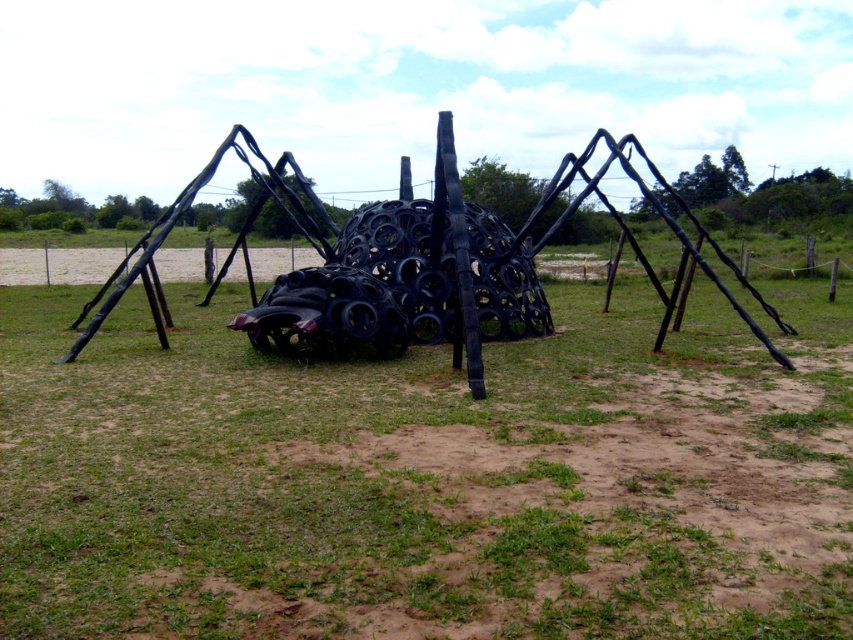
Question: Which point is farther to the camera?

Choices:
 (A) brown soil at center
 (B) black matte sculpture at center

Answer: (B)

Question: Which of the following is the closest to the observer?

Choices:
 (A) (494, 554)
 (B) (259, 200)

Answer: (A)

Question: Does brown soil at center have a larger size compared to black matte sculpture at center?

Choices:
 (A) no
 (B) yes

Answer: (A)

Question: Which point appears farthest from the camera in this image?

Choices:
 (A) (738, 280)
 (B) (19, 349)

Answer: (A)

Question: Does brown soil at center have a larger size compared to black matte sculpture at center?

Choices:
 (A) yes
 (B) no

Answer: (B)

Question: Is brown soil at center to the right of black matte sculpture at center from the viewer's perspective?

Choices:
 (A) yes
 (B) no

Answer: (B)